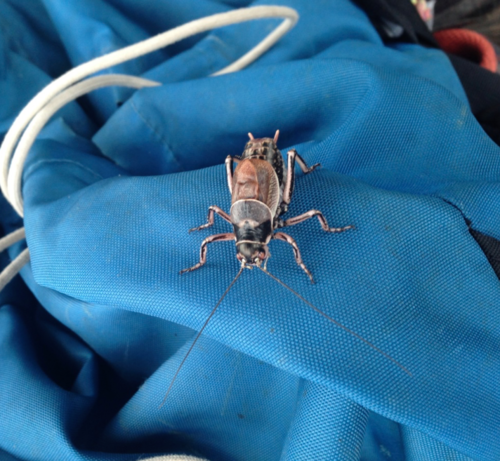
Where is `blue cloth`? The image size is (500, 461). blue cloth is located at coordinates (438, 365).